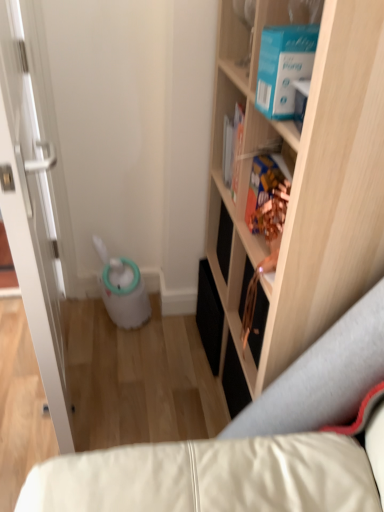
Question: From the image's perspective, is multicolored cardboard book at upper right above or below white glossy door at left?

Choices:
 (A) below
 (B) above

Answer: (B)

Question: Is point (269, 168) positioned closer to the camera than point (54, 125)?

Choices:
 (A) farther
 (B) closer

Answer: (B)

Question: Which object is the closest to the white glossy door at left?

Choices:
 (A) light wood cabinet at upper right
 (B) multicolored cardboard book at upper right

Answer: (A)

Question: Which of these objects is positioned farthest from the multicolored cardboard book at upper right?

Choices:
 (A) light wood cabinet at upper right
 (B) white glossy door at left

Answer: (B)